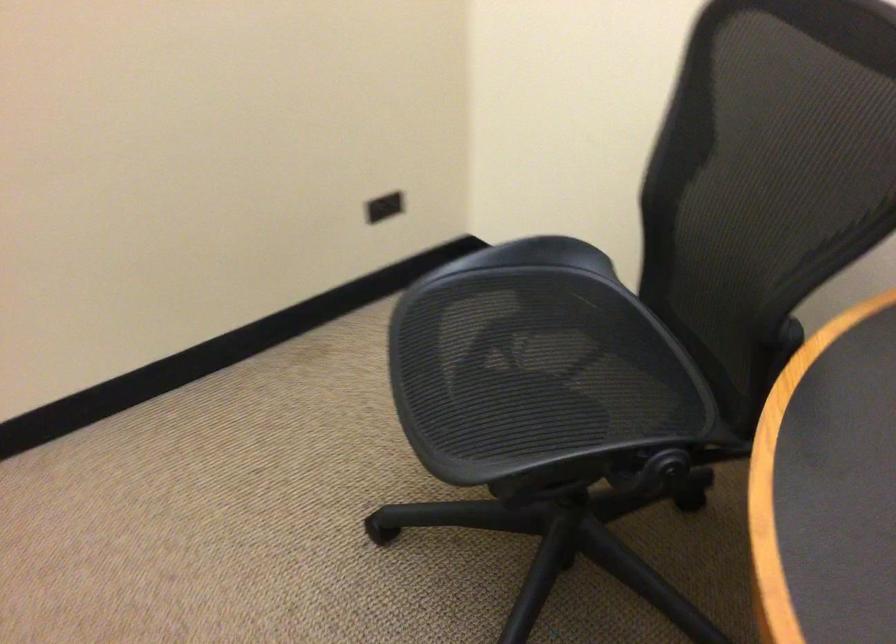
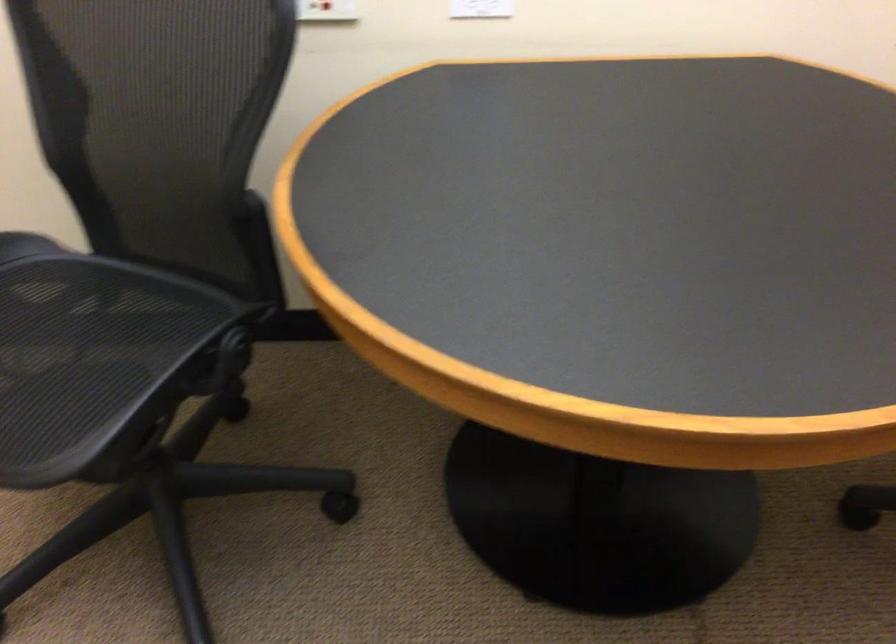
Find the pixel in the second image that matches point 761,411 in the first image.

(264, 277)